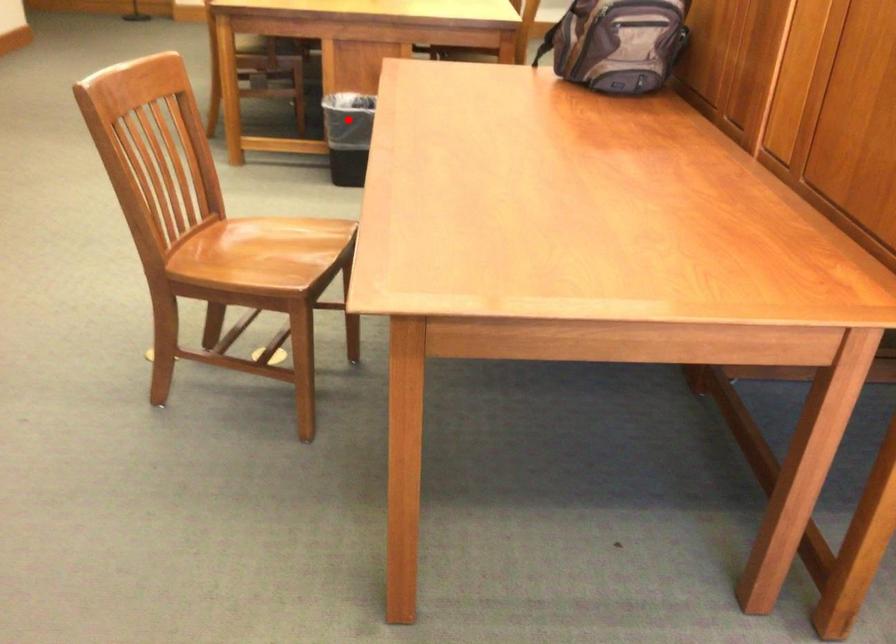
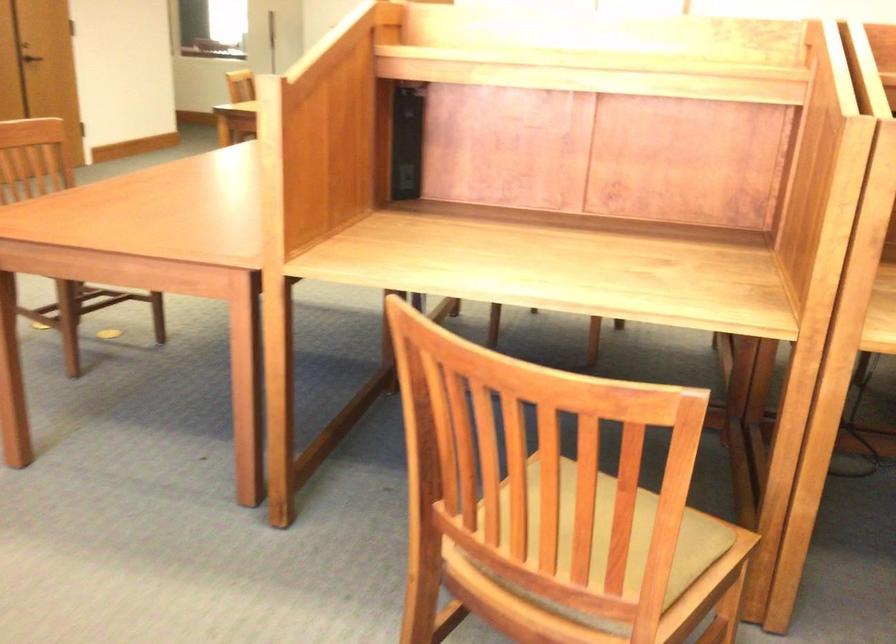
Question: I am providing you with two images of the same scene from different viewpoints. A red point is marked on the first image. Can you still see the location of the red point in image 2?

Choices:
 (A) Yes
 (B) No

Answer: (B)